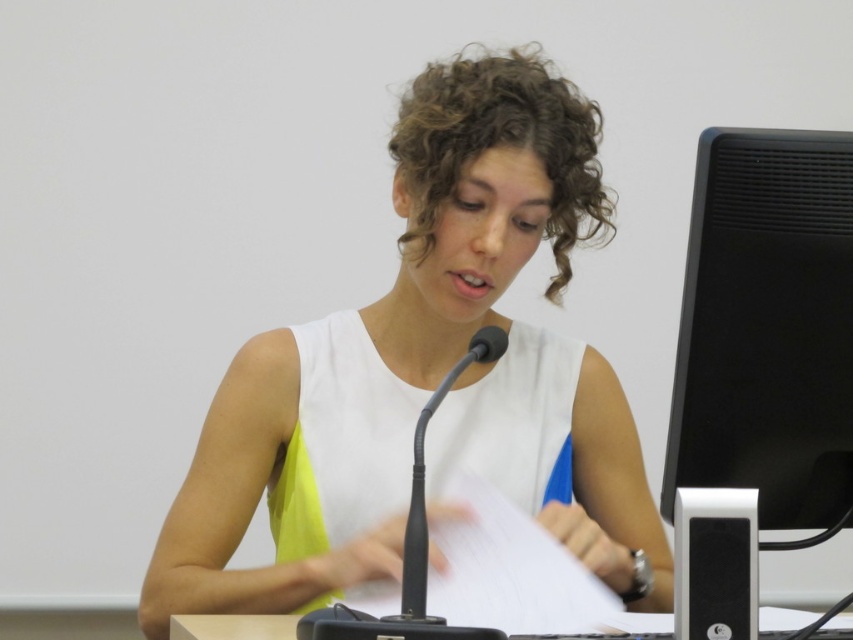
Question: Can you confirm if black plastic microphone at center is positioned above white plastic table at lower center?

Choices:
 (A) no
 (B) yes

Answer: (B)

Question: Does white matte dress at center lie in front of white plastic table at lower center?

Choices:
 (A) yes
 (B) no

Answer: (A)

Question: Among these objects, which one is farthest from the camera?

Choices:
 (A) black plastic microphone at center
 (B) white plastic table at lower center
 (C) white matte dress at center
 (D) black matte computer monitor at right

Answer: (B)

Question: Which of the following is the farthest from the observer?

Choices:
 (A) black plastic microphone at center
 (B) black matte computer monitor at right

Answer: (B)

Question: Which object appears closest to the camera in this image?

Choices:
 (A) white plastic table at lower center
 (B) black plastic microphone at center
 (C) white matte dress at center
 (D) black matte computer monitor at right

Answer: (B)

Question: Is black plastic microphone at center thinner than white plastic table at lower center?

Choices:
 (A) yes
 (B) no

Answer: (A)